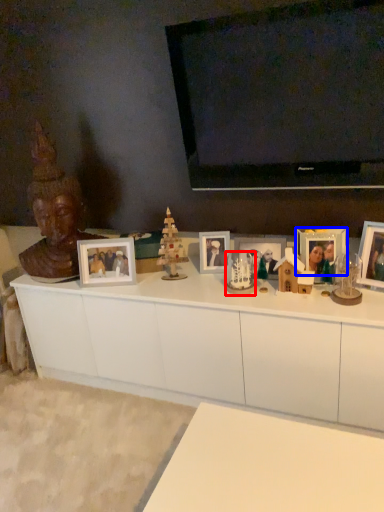
Question: Which of the following is the closest to the observer, toy (highlighted by a red box) or picture frame (highlighted by a blue box)?

Choices:
 (A) toy
 (B) picture frame

Answer: (A)